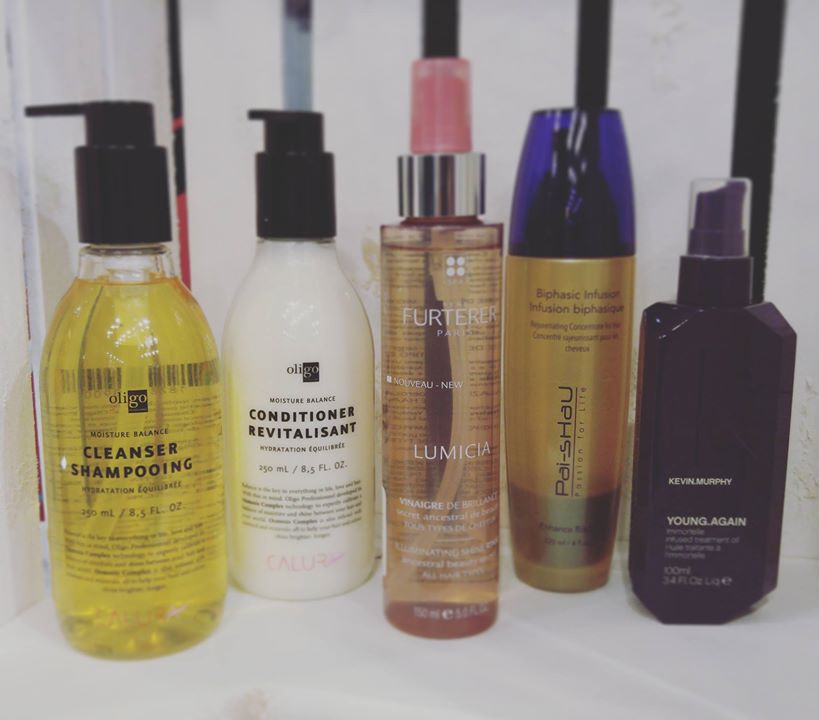
Image resolution: width=819 pixels, height=720 pixels. Find the location of `personal care items`. personal care items is located at coordinates (143, 446), (243, 420), (463, 391), (572, 360), (711, 463).